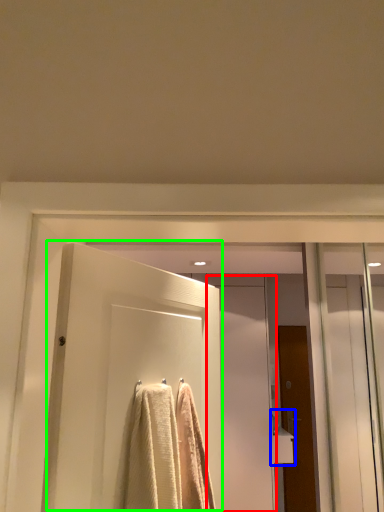
Question: Based on their relative distances, which object is nearer to screen door (highlighted by a red box)? Choose from sink (highlighted by a blue box) and door (highlighted by a green box).

Choices:
 (A) sink
 (B) door

Answer: (A)